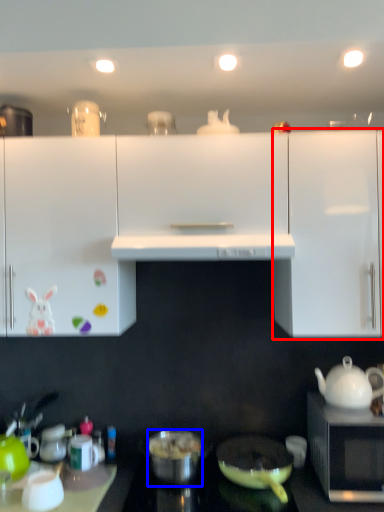
Question: Among these objects, which one is nearest to the camera, cabinetry (highlighted by a red box) or pot/pan (highlighted by a blue box)?

Choices:
 (A) cabinetry
 (B) pot/pan

Answer: (A)